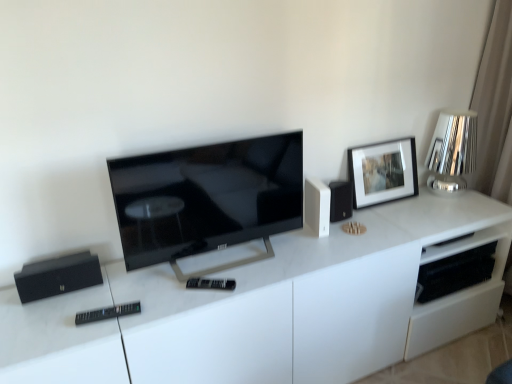
Locate an element on the screen. The width and height of the screenshot is (512, 384). black plastic remote at center, which ranks as the first remote in top-to-bottom order is located at coordinates (211, 284).

Find the location of `white glossy cabinet at center`. white glossy cabinet at center is located at coordinates (270, 308).

This screenshot has height=384, width=512. In order to click on white matte speaker at upper right in this screenshot , I will do `click(317, 206)`.

This screenshot has width=512, height=384. Describe the element at coordinates (452, 151) in the screenshot. I see `shiny metallic lamp at upper right` at that location.

Where is `black matte speaker at left`? The height and width of the screenshot is (384, 512). black matte speaker at left is located at coordinates (58, 276).

The height and width of the screenshot is (384, 512). Describe the element at coordinates (106, 313) in the screenshot. I see `black plastic remote at lower left, marked as the second remote in a right-to-left arrangement` at that location.

The width and height of the screenshot is (512, 384). Describe the element at coordinates (207, 197) in the screenshot. I see `matte black tv at center` at that location.

In order to click on matte black picture frame at upper right in this screenshot , I will do `click(383, 172)`.

This screenshot has height=384, width=512. I want to click on black plastic remote at center, placed as the second remote when sorted from left to right, so click(211, 284).

Consider the image. From the image's perspective, which is below, matte black picture frame at upper right or matte black tv at center?

matte black tv at center appears lower in the image.

Is matte black picture frame at upper right thinner than matte black tv at center?

Yes, matte black picture frame at upper right is thinner than matte black tv at center.

How distant is matte black picture frame at upper right from matte black tv at center?

matte black picture frame at upper right is 25.35 inches from matte black tv at center.

Considering the positions of objects matte black picture frame at upper right and matte black tv at center in the image provided, who is behind, matte black picture frame at upper right or matte black tv at center?

matte black picture frame at upper right is behind.

Is black plastic remote at center, placed as the second remote when sorted from left to right, to the left or to the right of matte black picture frame at upper right in the image?

black plastic remote at center, placed as the second remote when sorted from left to right, is to the left of matte black picture frame at upper right.

Is black plastic remote at center, the 1th remote when ordered from right to left, next to matte black picture frame at upper right?

black plastic remote at center, the 1th remote when ordered from right to left, and matte black picture frame at upper right are clearly separated.

Is black plastic remote at center, which appears as the 2th remote when ordered from the bottom, inside or outside of matte black picture frame at upper right?

black plastic remote at center, which appears as the 2th remote when ordered from the bottom, is not enclosed by matte black picture frame at upper right.

Considering their positions, is black plastic remote at lower left, acting as the first remote starting from the left, located in front of or behind black matte speaker at left?

In the image, black plastic remote at lower left, acting as the first remote starting from the left, appears in front of black matte speaker at left.

Based on the photo, can you confirm if black plastic remote at lower left, the 1th remote in the front-to-back sequence, is thinner than black matte speaker at left?

Yes, black plastic remote at lower left, the 1th remote in the front-to-back sequence, is thinner than black matte speaker at left.

Is black plastic remote at lower left, marked as the 2th remote in a back-to-front arrangement, to the right of black matte speaker at left from the viewer's perspective?

Correct, you'll find black plastic remote at lower left, marked as the 2th remote in a back-to-front arrangement, to the right of black matte speaker at left.

From the image's perspective, which is above, black plastic remote at lower left, placed as the 2th remote when sorted from top to bottom, or black matte speaker at left?

From the image's view, black matte speaker at left is above.

From a real-world perspective, does black matte speaker at left stand above white glossy cabinet at center?

Indeed, from a real-world perspective, black matte speaker at left stands above white glossy cabinet at center.

Who is more distant, black matte speaker at left or white glossy cabinet at center?

black matte speaker at left is further from the camera.

Identify the location of cabinetry on the right of black matte speaker at left. The height and width of the screenshot is (384, 512). (270, 308).

Considering the sizes of objects black matte speaker at left and white glossy cabinet at center in the image provided, who is shorter, black matte speaker at left or white glossy cabinet at center?

black matte speaker at left is shorter.

Is black matte speaker at left located within black plastic remote at center, which appears as the 2th remote when ordered from the bottom?

No, black matte speaker at left is located outside of black plastic remote at center, which appears as the 2th remote when ordered from the bottom.

Is black plastic remote at center, the 1th remote when ordered from right to left, facing away from black matte speaker at left?

black plastic remote at center, the 1th remote when ordered from right to left, is not turned away from black matte speaker at left.

Which of these two, black plastic remote at center, the second remote positioned from the front, or black matte speaker at left, is smaller?

With smaller size is black plastic remote at center, the second remote positioned from the front.

Can you confirm if black plastic remote at center, the 1th remote when ordered from right to left, is thinner than black matte speaker at left?

Correct, the width of black plastic remote at center, the 1th remote when ordered from right to left, is less than that of black matte speaker at left.

Looking at this image, choose the correct answer: Is white glossy cabinet at center inside black plastic remote at center, the 1th remote when ordered from right to left, or outside it?

The correct answer is: outside.

Does point (493, 212) lie behind point (193, 284)?

That is True.

Is white glossy cabinet at center bigger or smaller than black plastic remote at center, which ranks as the first remote in top-to-bottom order?

Clearly, white glossy cabinet at center is larger in size than black plastic remote at center, which ranks as the first remote in top-to-bottom order.

Is white glossy cabinet at center wider than black plastic remote at center, the second remote positioned from the front?

Indeed, white glossy cabinet at center has a greater width compared to black plastic remote at center, the second remote positioned from the front.

From the image's perspective, which is above, white matte speaker at upper right or matte black picture frame at upper right?

From the image's view, matte black picture frame at upper right is above.

Would you say white matte speaker at upper right contains matte black picture frame at upper right?

No, white matte speaker at upper right does not contain matte black picture frame at upper right.

Which is nearer, (311,210) or (382,150)?

Point (311,210)

Find the location of a particular element. The width and height of the screenshot is (512, 384). television located below the matte black picture frame at upper right (from the image's perspective) is located at coordinates (207, 197).

Starting from the matte black picture frame at upper right, which remote is the 1st one to the left? Please provide its 2D coordinates.

[(211, 284)]

From the image, which object appears to be farther from matte black tv at center, white glossy cabinet at center or matte black picture frame at upper right?

matte black picture frame at upper right lies further to matte black tv at center than the other object.

Considering their positions, is white matte speaker at upper right positioned further to white glossy cabinet at center than black plastic remote at lower left, placed as the 2th remote when sorted from top to bottom?

black plastic remote at lower left, placed as the 2th remote when sorted from top to bottom, lies further to white glossy cabinet at center than the other object.

Consider the image. Considering their positions, is black matte speaker at left positioned further to matte black tv at center than shiny metallic lamp at upper right?

Based on the image, shiny metallic lamp at upper right appears to be further to matte black tv at center.

Considering their positions, is black plastic remote at center, acting as the 1th remote starting from the back, positioned closer to black matte speaker at left than black plastic remote at lower left, marked as the 2th remote in a back-to-front arrangement?

black plastic remote at lower left, marked as the 2th remote in a back-to-front arrangement, is closer to black matte speaker at left.

Which object lies further to the anchor point black matte speaker at left, white glossy cabinet at center or matte black tv at center?

Based on the image, white glossy cabinet at center appears to be further to black matte speaker at left.

Which object lies further to the anchor point black plastic remote at center, which appears as the 2th remote when ordered from the bottom, white matte speaker at upper right or matte black tv at center?

white matte speaker at upper right.

Looking at the image, which one is located closer to white matte speaker at upper right, black plastic remote at center, acting as the 1th remote starting from the back, or matte black picture frame at upper right?

matte black picture frame at upper right.

Based on their spatial positions, is matte black picture frame at upper right or black matte speaker at left further from white matte speaker at upper right?

black matte speaker at left lies further to white matte speaker at upper right than the other object.

Find the location of a particular element. The image size is (512, 384). television between black matte speaker at left and white glossy cabinet at center in the horizontal direction is located at coordinates (207, 197).

Where is `television situated between black matte speaker at left and white matte speaker at upper right from left to right`? television situated between black matte speaker at left and white matte speaker at upper right from left to right is located at coordinates (207, 197).

This screenshot has width=512, height=384. I want to click on remote located between black plastic remote at lower left, marked as the 2th remote in a back-to-front arrangement, and white glossy cabinet at center in the left-right direction, so click(211, 284).

At what (x,y) coordinates should I click in order to perform the action: click on speaker between black matte speaker at left and shiny metallic lamp at upper right in the horizontal direction. Please return your answer as a coordinate pair (x, y). Image resolution: width=512 pixels, height=384 pixels. Looking at the image, I should click on (317, 206).